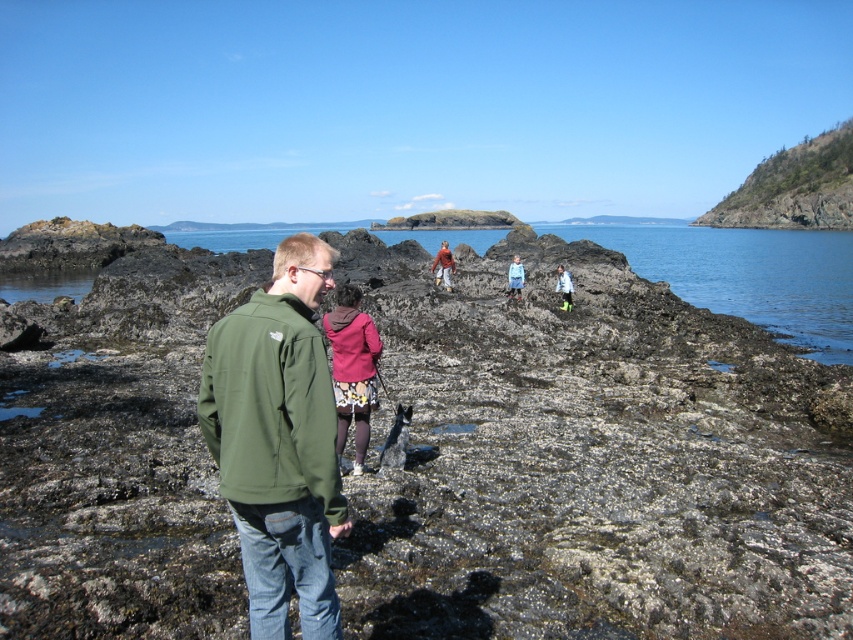
Between green softshell jacket at center and blue denim jacket at center, which one appears on the right side from the viewer's perspective?

blue denim jacket at center

Which is above, green softshell jacket at center or blue denim jacket at center?

Positioned higher is blue denim jacket at center.

Locate an element on the screen. This screenshot has height=640, width=853. green softshell jacket at center is located at coordinates (277, 442).

Where is `matte red sweater at center`? This screenshot has height=640, width=853. matte red sweater at center is located at coordinates click(444, 266).

Is matte red sweater at center bigger than blue denim jacket at center?

No.

Which is in front, point (434, 259) or point (519, 296)?

Point (519, 296)

Identify the location of matte red sweater at center. Image resolution: width=853 pixels, height=640 pixels. (444, 266).

Does green softshell jacket at center have a lesser width compared to light blue rubber boots at center?

In fact, green softshell jacket at center might be wider than light blue rubber boots at center.

At what (x,y) coordinates should I click in order to perform the action: click on green softshell jacket at center. Please return your answer as a coordinate pair (x, y). Image resolution: width=853 pixels, height=640 pixels. Looking at the image, I should click on (277, 442).